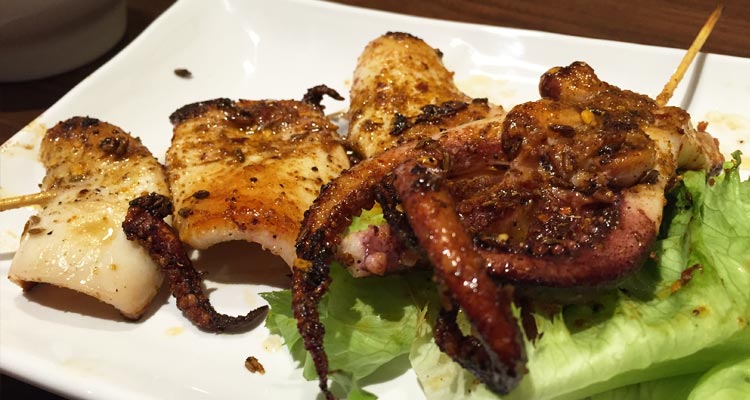
Where is `white porcelain plate upper rignt`? This screenshot has height=400, width=750. white porcelain plate upper rignt is located at coordinates (726, 82).